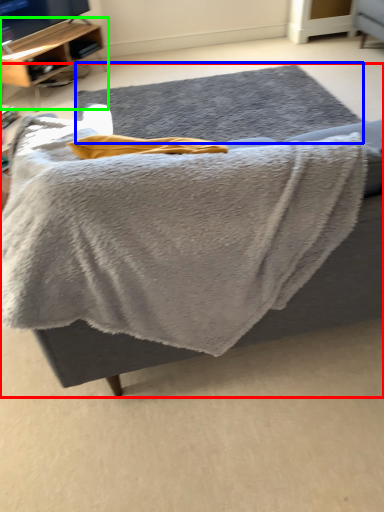
Question: Based on their relative distances, which object is nearer to furniture (highlighted by a red box)? Choose from mat (highlighted by a blue box) and shelf (highlighted by a green box).

Choices:
 (A) mat
 (B) shelf

Answer: (A)